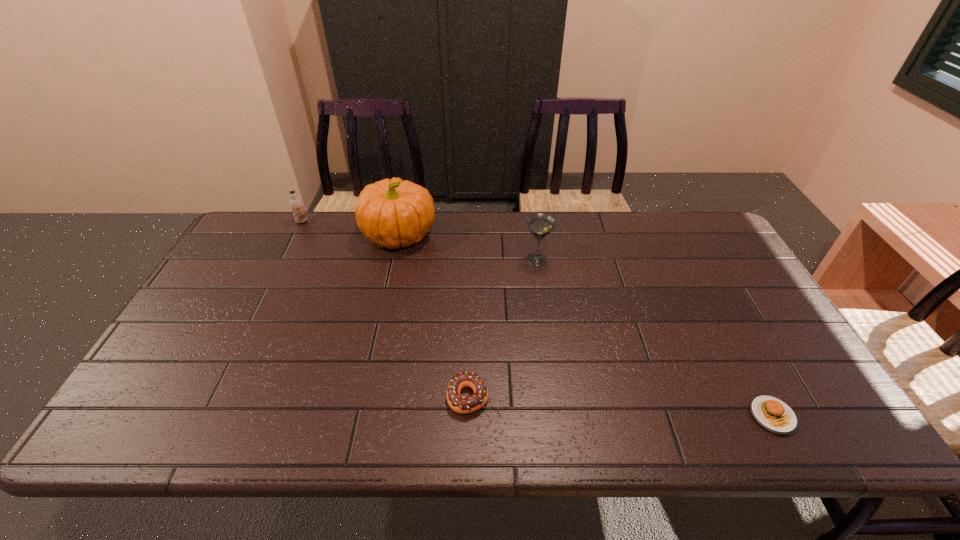
At what (x,y) coordinates should I click in order to perform the action: click on the fourth object from right to left. Please return your answer as a coordinate pair (x, y). Image resolution: width=960 pixels, height=540 pixels. Looking at the image, I should click on (391, 213).

Where is `pumpkin`? The image size is (960, 540). pumpkin is located at coordinates (391, 213).

At what (x,y) coordinates should I click in order to perform the action: click on the second object from right to left. Please return your answer as a coordinate pair (x, y). Looking at the image, I should click on (540, 225).

Find the location of a particular element. The height and width of the screenshot is (540, 960). the second tallest object is located at coordinates (540, 225).

Identify the location of the third shortest object. (296, 204).

Where is `chocolate milk`? The height and width of the screenshot is (540, 960). chocolate milk is located at coordinates (296, 204).

Locate an element on the screen. doughnut is located at coordinates coord(463,405).

Where is `the third object from right to left`? the third object from right to left is located at coordinates (463, 405).

This screenshot has height=540, width=960. I want to click on the rightmost object, so click(773, 414).

You are a GUI agent. You are given a task and a screenshot of the screen. Output one action in this format:
    pyautogui.click(x=<x>, y=<y>)
    Task: Click on the food
    The width and height of the screenshot is (960, 540).
    Given the screenshot: What is the action you would take?
    pyautogui.click(x=773, y=414)